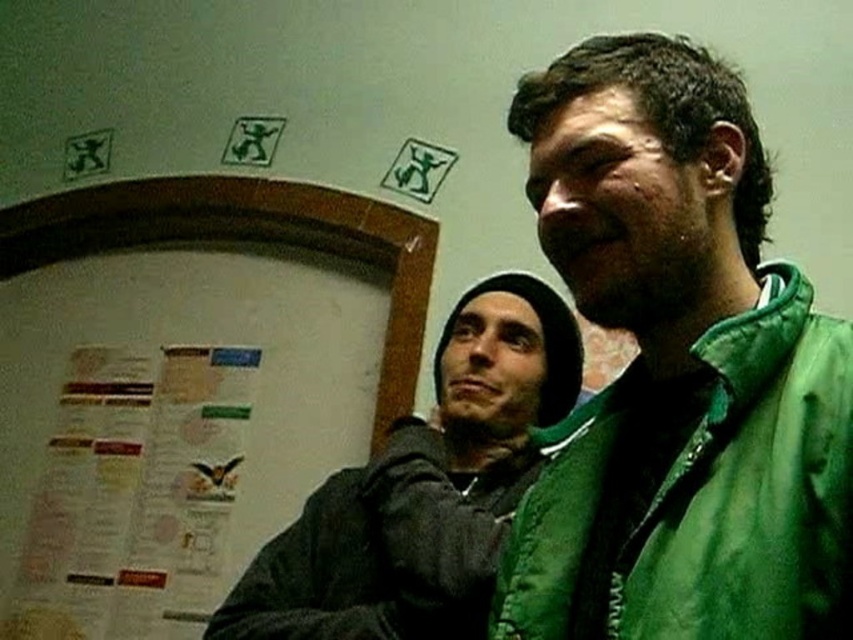
You are standing in the scene and want to hand a document to the person in the black jacket and beanie. The document is on the white paper at left. Can you reach it without moving from your current position?

The white paper at left is located at point (186, 385). Since you are standing in the scene, the exact coordinates would determine reachability, but based on the given information, it is unclear if you can reach the white paper at left without moving. Additional spatial details about your position relative to the paper are needed to confirm.

You are organizing a small event and need to know if the white paper at left can cover the green quilted jacket at right completely. Can it?

The white paper at left might be wider than green quilted jacket at right, but since the exact dimensions aren